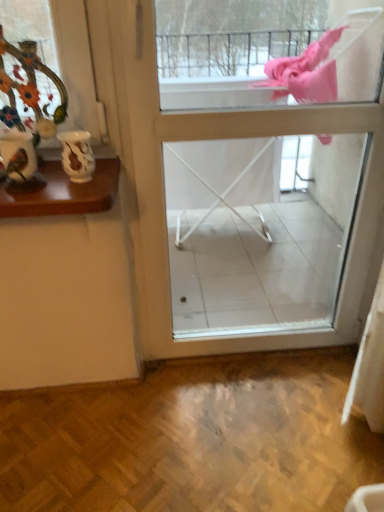
Question: From a real-world perspective, is porcelain vase at upper left located beneath white glossy screen door at center?

Choices:
 (A) no
 (B) yes

Answer: (A)

Question: Could you tell me if porcelain vase at upper left is facing white glossy screen door at center?

Choices:
 (A) yes
 (B) no

Answer: (B)

Question: Is porcelain vase at upper left positioned with its back to white glossy screen door at center?

Choices:
 (A) yes
 (B) no

Answer: (B)

Question: Considering the relative positions of porcelain vase at upper left and white glossy screen door at center in the image provided, is porcelain vase at upper left to the left of white glossy screen door at center from the viewer's perspective?

Choices:
 (A) no
 (B) yes

Answer: (B)

Question: Is porcelain vase at upper left taller than white glossy screen door at center?

Choices:
 (A) yes
 (B) no

Answer: (B)

Question: Can white glossy screen door at center be found inside porcelain vase at upper left?

Choices:
 (A) no
 (B) yes

Answer: (A)

Question: Is white glossy vase at upper left not near porcelain vase at upper left?

Choices:
 (A) yes
 (B) no

Answer: (B)

Question: Can you confirm if white glossy vase at upper left is positioned to the right of porcelain vase at upper left?

Choices:
 (A) yes
 (B) no

Answer: (A)

Question: Is white glossy vase at upper left bigger than porcelain vase at upper left?

Choices:
 (A) no
 (B) yes

Answer: (A)

Question: From a real-world perspective, is white glossy vase at upper left physically above porcelain vase at upper left?

Choices:
 (A) yes
 (B) no

Answer: (B)

Question: Does white glossy vase at upper left have a lesser height compared to porcelain vase at upper left?

Choices:
 (A) yes
 (B) no

Answer: (A)

Question: Is the surface of white glossy vase at upper left in direct contact with porcelain vase at upper left?

Choices:
 (A) yes
 (B) no

Answer: (B)

Question: Are porcelain vase at upper left and white glossy vase at upper left located far from each other?

Choices:
 (A) no
 (B) yes

Answer: (A)